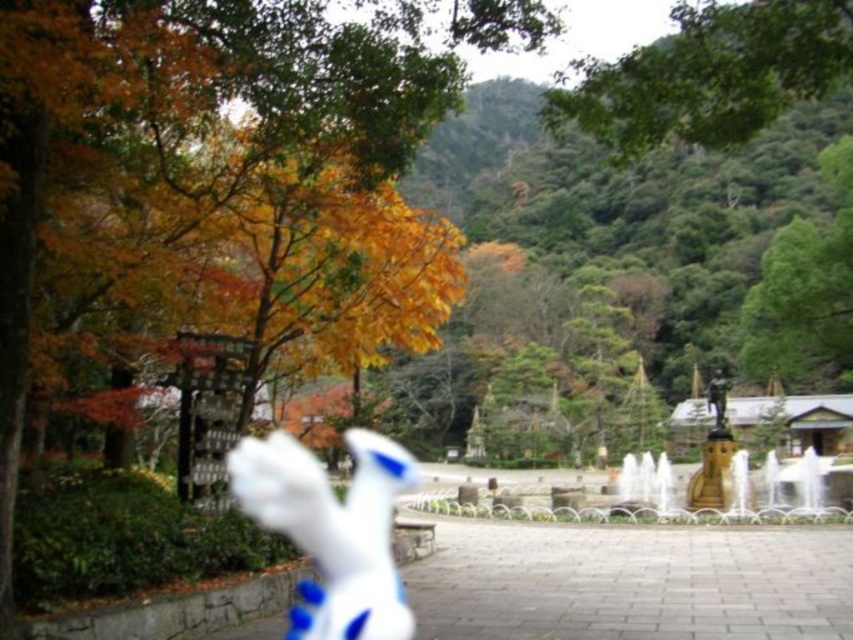
Is green leafy tree at upper center below gold metallic fountain at center right?

Actually, green leafy tree at upper center is above gold metallic fountain at center right.

Locate an element on the screen. Image resolution: width=853 pixels, height=640 pixels. green leafy tree at upper center is located at coordinates (709, 76).

This screenshot has height=640, width=853. Describe the element at coordinates (709, 76) in the screenshot. I see `green leafy tree at upper center` at that location.

Locate an element on the screen. green leafy tree at upper center is located at coordinates (709, 76).

Can you confirm if green leafy tree at upper center is thinner than white rubber toy at center?

No, green leafy tree at upper center is not thinner than white rubber toy at center.

Is point (822, 65) closer to camera compared to point (283, 451)?

That is True.

At what (x,y) coordinates should I click in order to perform the action: click on green leafy tree at upper center. Please return your answer as a coordinate pair (x, y). This screenshot has width=853, height=640. Looking at the image, I should click on (709, 76).

Is white rubber toy at center further to the viewer compared to gold metallic fountain at center right?

No, it is in front of gold metallic fountain at center right.

Identify the location of white rubber toy at center. (332, 529).